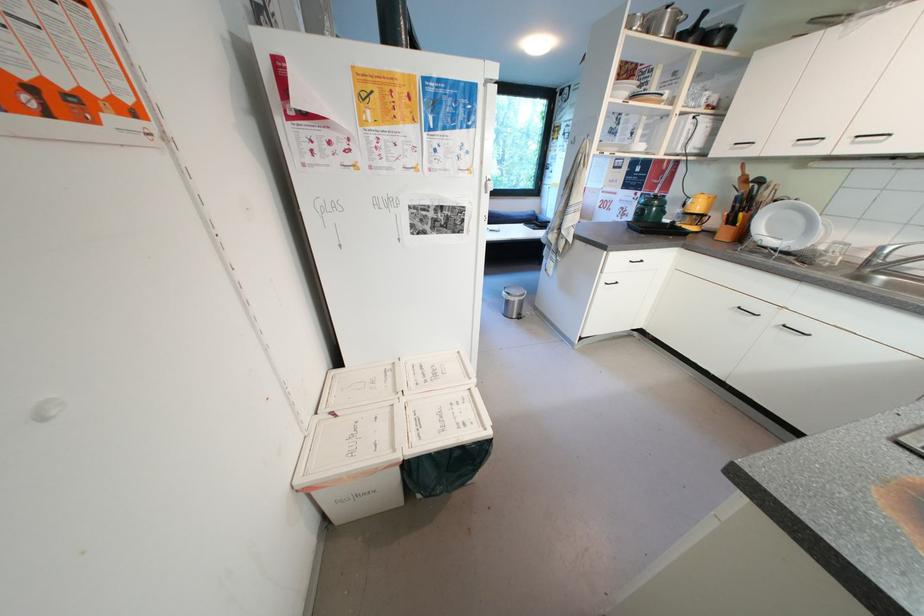
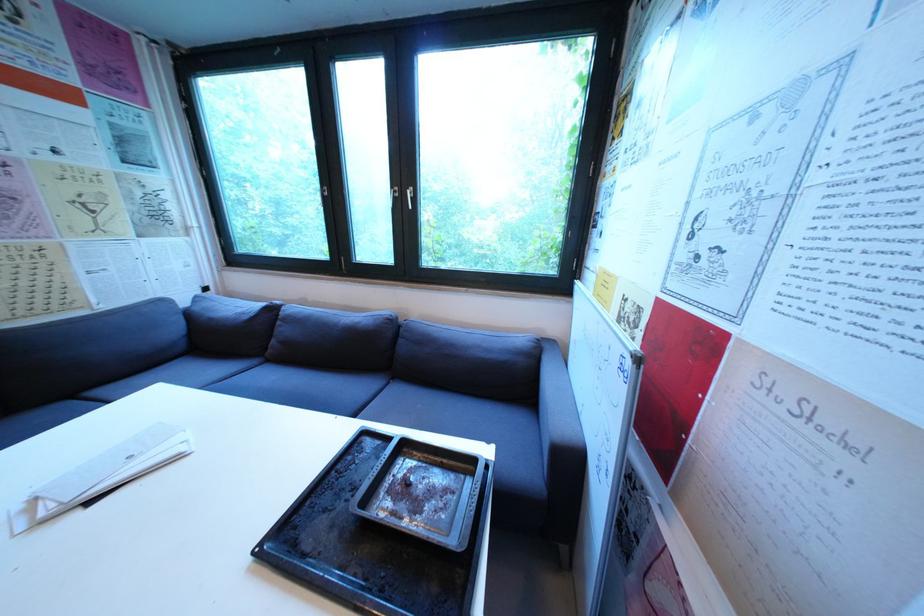
In a continuous first-person perspective shot, in which direction is the camera moving?

The cameraman moved toward right, forward.